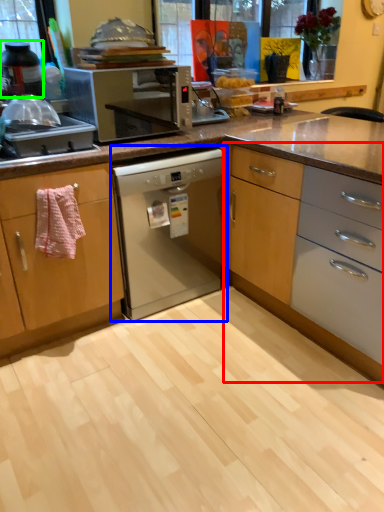
Question: Which object is positioned farthest from cabinetry (highlighted by a red box)? Select from home appliance (highlighted by a blue box) and kitchen appliance (highlighted by a green box).

Choices:
 (A) home appliance
 (B) kitchen appliance

Answer: (B)